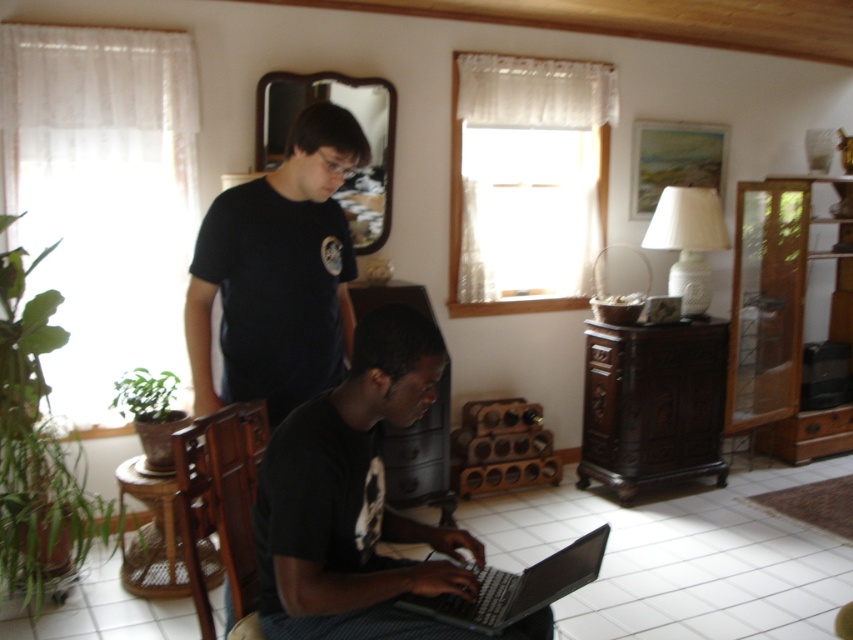
Where is the black matte laptop at lower center located in the image?

The black matte laptop at lower center is located at point (x=354, y=499).